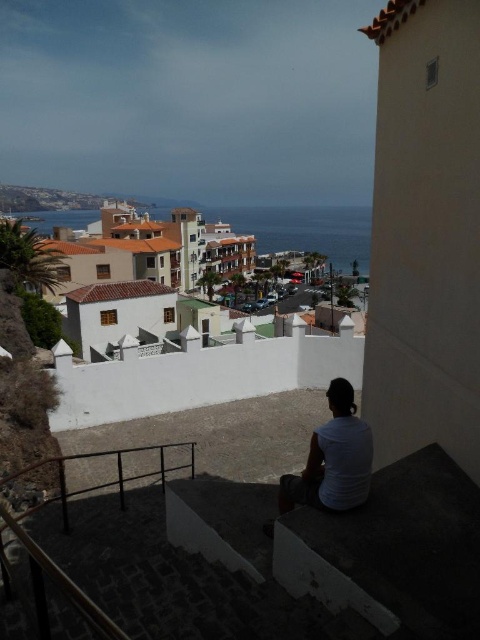
Question: Is blue water at center bigger than white matte shirt at lower center?

Choices:
 (A) yes
 (B) no

Answer: (A)

Question: Which point appears closest to the camera in this image?

Choices:
 (A) (24, 512)
 (B) (295, 214)

Answer: (A)

Question: Estimate the real-world distances between objects in this image. Which object is closer to the black metal rail at lower left?

Choices:
 (A) blue water at center
 (B) white matte shirt at lower center

Answer: (B)

Question: Among these points, which one is nearest to the camera?

Choices:
 (A) (333, 449)
 (B) (99, 451)

Answer: (A)

Question: Can you confirm if blue water at center is bigger than black metal rail at lower left?

Choices:
 (A) no
 (B) yes

Answer: (B)

Question: Is white matte shirt at lower center thinner than black metal rail at lower left?

Choices:
 (A) no
 (B) yes

Answer: (B)